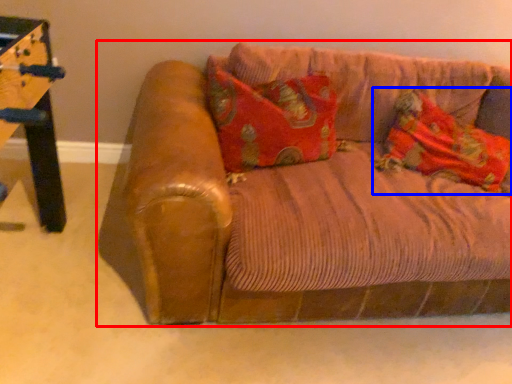
Question: Which point is further to the camera, studio couch (highlighted by a red box) or material (highlighted by a blue box)?

Choices:
 (A) studio couch
 (B) material

Answer: (B)